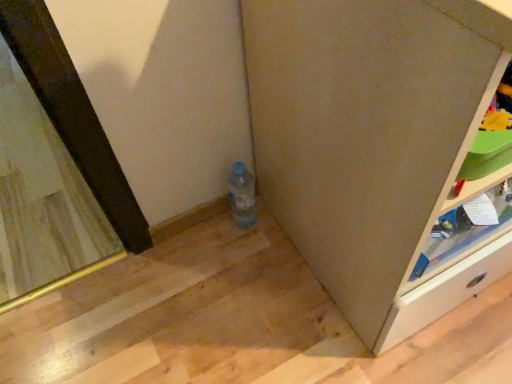
Question: Can you confirm if light brown wooden shelf at right is taller than wooden frame mirror at left?

Choices:
 (A) no
 (B) yes

Answer: (B)

Question: Can you confirm if light brown wooden shelf at right is wider than wooden frame mirror at left?

Choices:
 (A) no
 (B) yes

Answer: (A)

Question: From a real-world perspective, is light brown wooden shelf at right on top of wooden frame mirror at left?

Choices:
 (A) no
 (B) yes

Answer: (B)

Question: Does light brown wooden shelf at right come behind wooden frame mirror at left?

Choices:
 (A) yes
 (B) no

Answer: (B)

Question: From the image's perspective, is light brown wooden shelf at right beneath wooden frame mirror at left?

Choices:
 (A) yes
 (B) no

Answer: (A)

Question: Is point (x=398, y=129) closer or farther from the camera than point (x=248, y=175)?

Choices:
 (A) closer
 (B) farther

Answer: (A)

Question: From the image's perspective, is matte gray cabinet at lower right above or below translucent plastic bottle at center?

Choices:
 (A) above
 (B) below

Answer: (A)

Question: Looking at their shapes, would you say matte gray cabinet at lower right is wider or thinner than translucent plastic bottle at center?

Choices:
 (A) thin
 (B) wide

Answer: (B)

Question: From their relative heights in the image, would you say matte gray cabinet at lower right is taller or shorter than translucent plastic bottle at center?

Choices:
 (A) tall
 (B) short

Answer: (A)

Question: In the image, is translucent plastic bottle at center on the left side or the right side of matte gray cabinet at lower right?

Choices:
 (A) left
 (B) right

Answer: (A)

Question: From the image's perspective, is translucent plastic bottle at center positioned above or below matte gray cabinet at lower right?

Choices:
 (A) below
 (B) above

Answer: (A)

Question: Considering their positions, is translucent plastic bottle at center located in front of or behind matte gray cabinet at lower right?

Choices:
 (A) behind
 (B) front

Answer: (A)

Question: Choose the correct answer: Is translucent plastic bottle at center inside matte gray cabinet at lower right or outside it?

Choices:
 (A) outside
 (B) inside

Answer: (A)

Question: From a real-world perspective, is matte gray cabinet at lower right physically located above or below wooden frame mirror at left?

Choices:
 (A) above
 (B) below

Answer: (A)

Question: Is matte gray cabinet at lower right taller or shorter than wooden frame mirror at left?

Choices:
 (A) short
 (B) tall

Answer: (B)